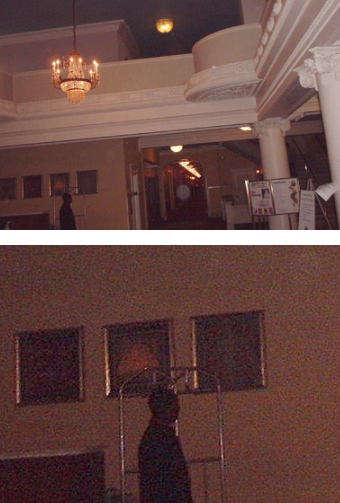
This screenshot has width=340, height=503. What are the coordinates of `posters` in the screenshot? It's located at (260, 193), (285, 181), (307, 206), (327, 189).